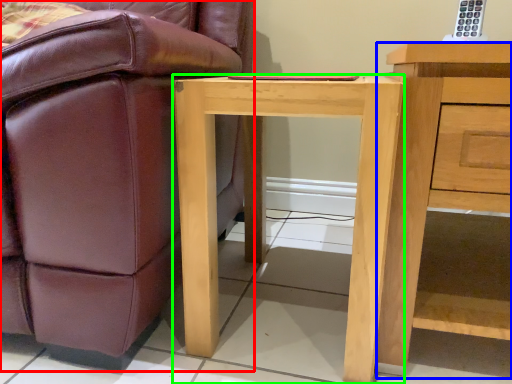
Question: Which object is the closest to the chair (highlighted by a red box)? Choose among these: nightstand (highlighted by a blue box) or desk (highlighted by a green box).

Choices:
 (A) nightstand
 (B) desk

Answer: (B)